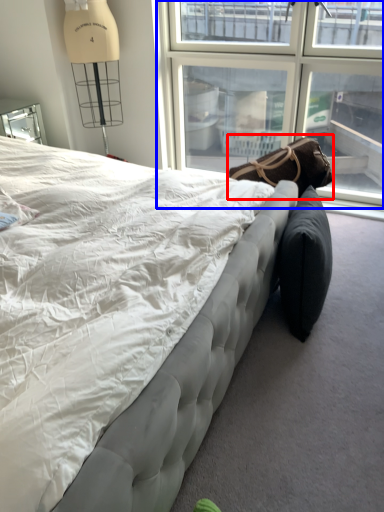
Question: Among these objects, which one is nearest to the camera, bean bag chair (highlighted by a red box) or window (highlighted by a blue box)?

Choices:
 (A) bean bag chair
 (B) window

Answer: (A)